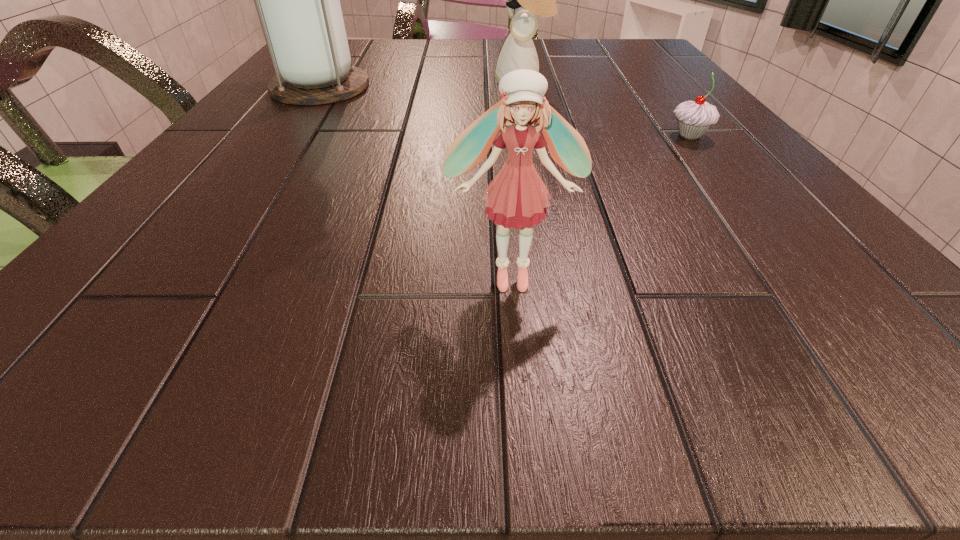
Identify the location of blank space at the right edge of the desktop. The width and height of the screenshot is (960, 540). (769, 199).

Where is `vacant area that lies between the rightmost object and the shorter doll`? This screenshot has height=540, width=960. vacant area that lies between the rightmost object and the shorter doll is located at coordinates (601, 206).

Find the location of `empty location between the taller doll and the lantern`. empty location between the taller doll and the lantern is located at coordinates (421, 85).

I want to click on free space between the third tallest object and the lantern, so click(416, 181).

This screenshot has width=960, height=540. I want to click on free space between the leftmost object and the shorter doll, so click(416, 181).

I want to click on empty location between the leftmost object and the farther doll, so click(x=421, y=85).

At what (x,y) coordinates should I click in order to perform the action: click on vacant area that lies between the nearer doll and the lantern. Please return your answer as a coordinate pair (x, y). The height and width of the screenshot is (540, 960). Looking at the image, I should click on (416, 181).

The width and height of the screenshot is (960, 540). In order to click on free space between the nearer doll and the cupcake in this screenshot , I will do `click(601, 206)`.

Point out which object is positioned as the nearest to the farther doll. Please provide its 2D coordinates. Your answer should be formatted as a tuple, i.e. [(x, y)], where the tuple contains the x and y coordinates of a point satisfying the conditions above.

[(693, 117)]

Identify which object is the third closest to the farther doll. Please provide its 2D coordinates. Your answer should be formatted as a tuple, i.e. [(x, y)], where the tuple contains the x and y coordinates of a point satisfying the conditions above.

[(517, 197)]